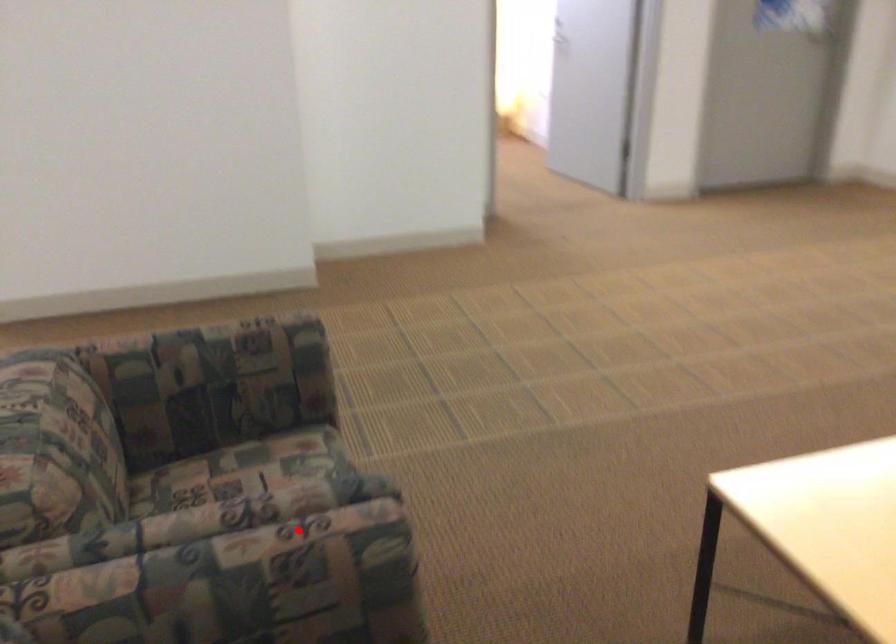
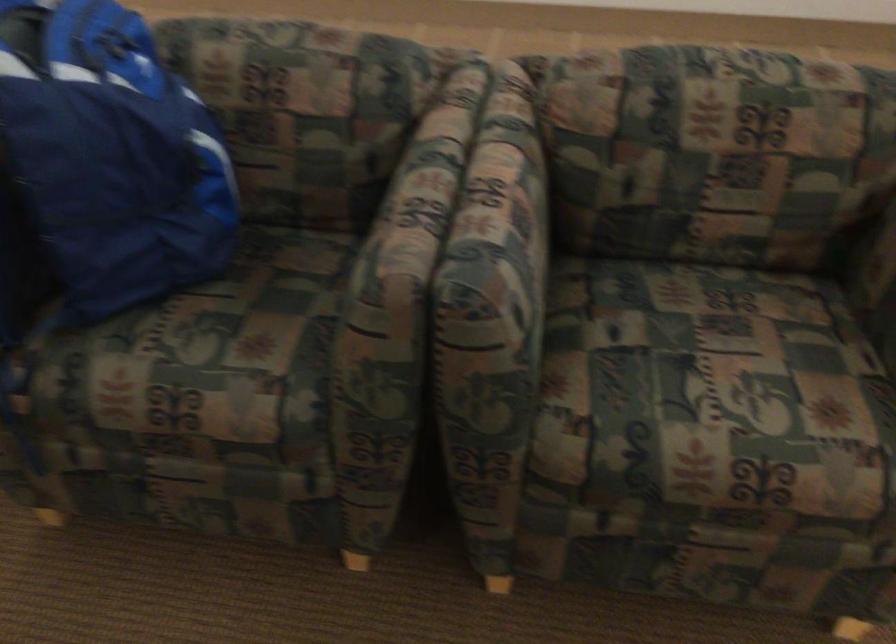
Where in the second image is the point corresponding to the highlighted location from the first image?

(412, 207)